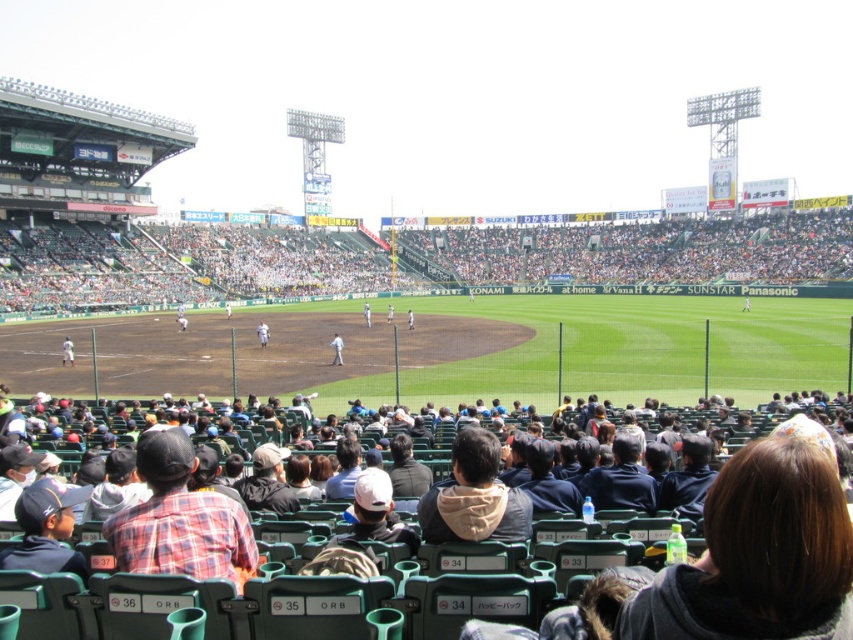
You are a photographer trying to capture a candid shot of the khaki fabric cap at center without including the plaid shirt at lower left in the frame. Based on their positions, is this possible?

The plaid shirt at lower left is to the left of the khaki fabric cap at center, so if you position your camera to the right side of the khaki fabric cap at center and avoid including the left side of the frame, you can capture the khaki fabric cap at center without the plaid shirt at lower left.

You are standing at the edge of the baseball field and want to reach a specific point marked at coordinates point (x=239, y=573). If you walk straight ahead from your current position, how far will you have to walk to reach that point?

You need to walk 122.46 feet straight ahead to reach point (x=239, y=573).

You are a spectator sitting in the stands and want to throw a baseball to a friend who is standing at the khaki fabric cap at center. If the average throwing distance for a spectator is 140 feet, will you be able to reach them?

The khaki fabric cap at center is 145.38 feet from viewer, which exceeds the average throwing distance of 140 feet, so you won